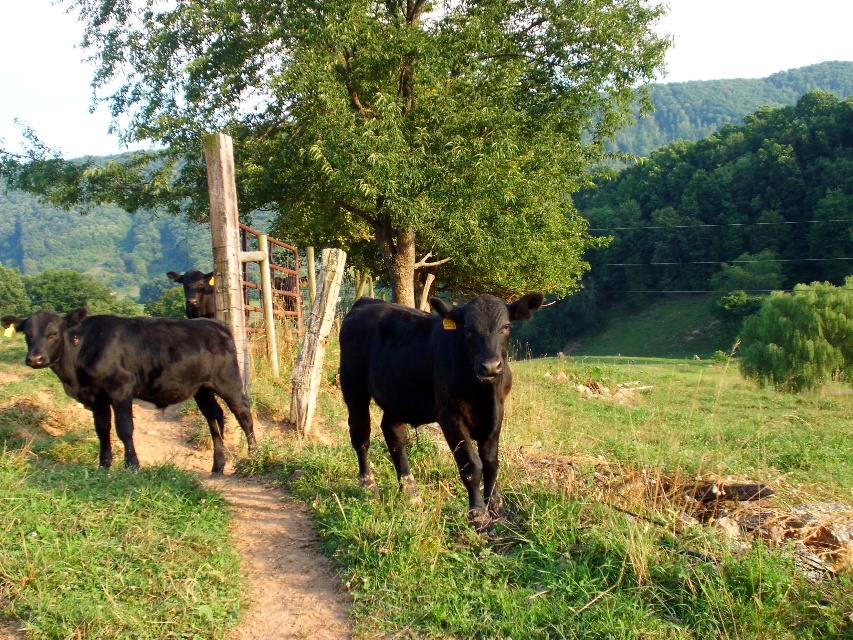
Question: Which point is farther to the camera?

Choices:
 (A) (469, 480)
 (B) (815, 356)

Answer: (B)

Question: Is green grassy at center closer to the viewer compared to black glossy cow at center?

Choices:
 (A) yes
 (B) no

Answer: (A)

Question: From the image, what is the correct spatial relationship of dirt path at center in relation to black glossy bull at center?

Choices:
 (A) right
 (B) left

Answer: (A)

Question: Among these objects, which one is farthest from the camera?

Choices:
 (A) black glossy bull at center
 (B) green grassy at center

Answer: (A)

Question: Can you confirm if dirt path at center is positioned below black glossy bull at center?

Choices:
 (A) yes
 (B) no

Answer: (A)

Question: Among these objects, which one is farthest from the camera?

Choices:
 (A) black glossy cow at left
 (B) black glossy bull at center
 (C) green leafy tree at right
 (D) green leafy tree at center

Answer: (C)